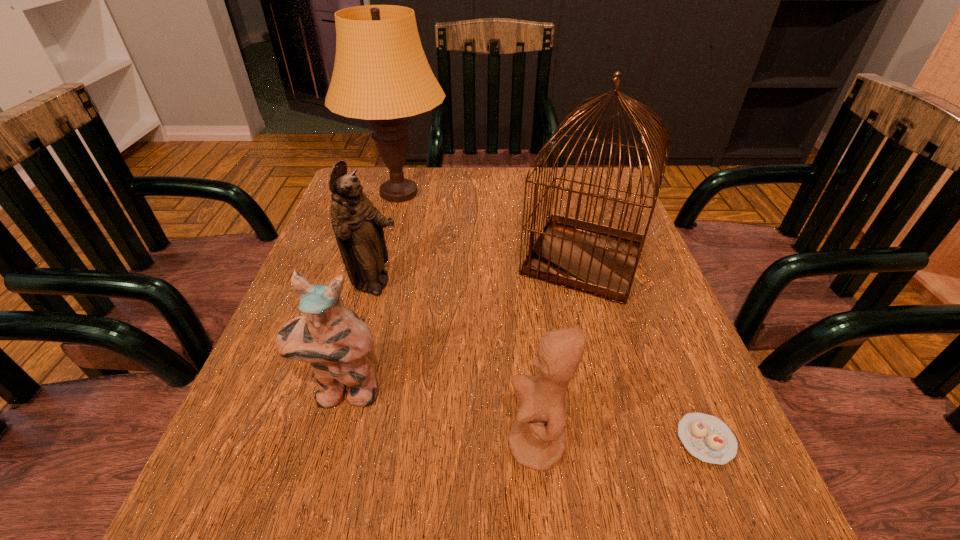
Identify the location of vacant space at the far left corner of the desktop. This screenshot has height=540, width=960. (x=372, y=185).

Locate an element on the screen. vacant space at the far right corner is located at coordinates (601, 174).

Where is `unoccupied area between the rightmost figurine and the lampshade`? The image size is (960, 540). unoccupied area between the rightmost figurine and the lampshade is located at coordinates (468, 319).

Locate an element on the screen. The image size is (960, 540). free space between the rightmost figurine and the lampshade is located at coordinates (468, 319).

Where is `vacant point located between the farthest figurine and the lampshade`? vacant point located between the farthest figurine and the lampshade is located at coordinates (387, 240).

Locate an element on the screen. unoccupied area between the lampshade and the birdcage is located at coordinates (492, 226).

The image size is (960, 540). What are the coordinates of `free space between the farthest figurine and the lampshade` in the screenshot? It's located at (387, 240).

Image resolution: width=960 pixels, height=540 pixels. What are the coordinates of `free area in between the birdcage and the shortest object` in the screenshot? It's located at (645, 349).

The width and height of the screenshot is (960, 540). What are the coordinates of `object that is the fifth closest to the farthest figurine` in the screenshot? It's located at (706, 437).

Find the location of a particular element. Image resolution: width=960 pixels, height=540 pixels. object that is the third closest to the rightmost figurine is located at coordinates (599, 260).